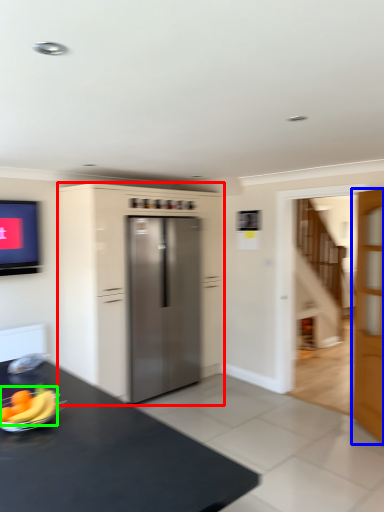
Question: Based on their relative distances, which object is nearer to cabinetry (highlighted by a red box)? Choose from door (highlighted by a blue box) and banana (highlighted by a green box).

Choices:
 (A) door
 (B) banana

Answer: (A)